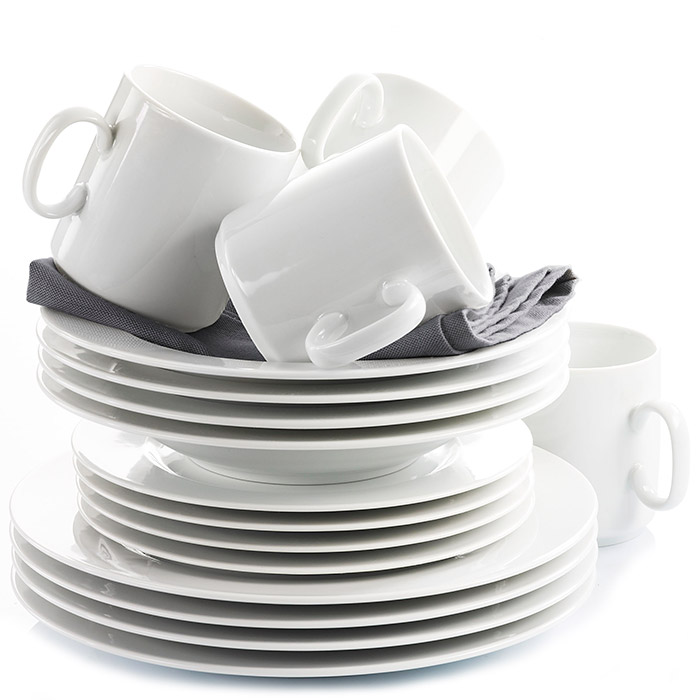
Find the location of a particular element. The height and width of the screenshot is (700, 700). white plates is located at coordinates (251, 666), (285, 645), (299, 624), (304, 595), (412, 560), (416, 533), (416, 517), (418, 490).